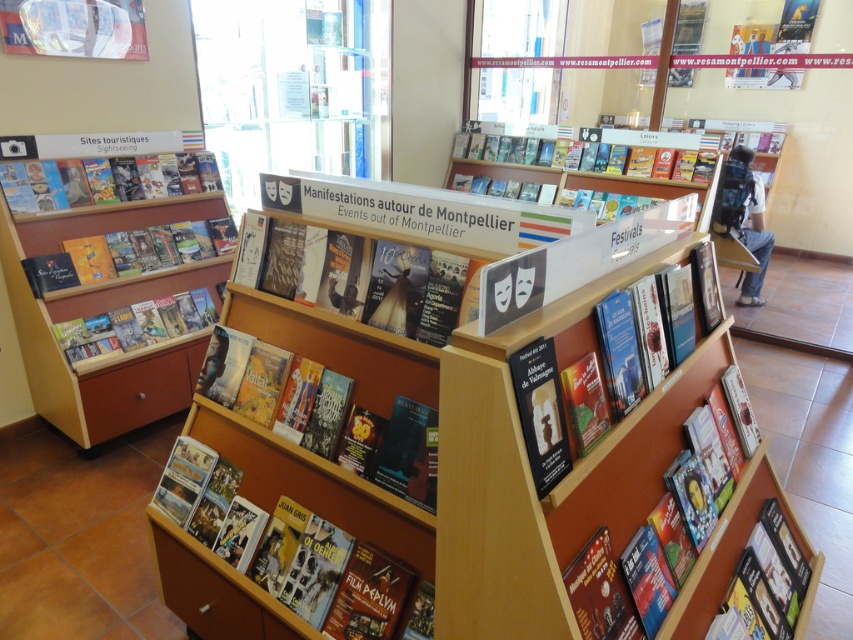
Does wooden bookshelf at left appear under matte black mask at center?

Actually, wooden bookshelf at left is above matte black mask at center.

Which of these two, wooden bookshelf at left or matte black mask at center, stands shorter?

With less height is matte black mask at center.

Does point (148, 164) come behind point (566, 465)?

Yes, it is behind point (566, 465).

Identify the location of wooden bookshelf at left. This screenshot has height=640, width=853. (119, 298).

Measure the distance between point (x=686, y=392) and camera.

Point (x=686, y=392) is 1.55 meters away from camera.

Find the location of a particular element. wooden bookshelf at right is located at coordinates (531, 474).

Is point (430, 563) positioned after point (202, 241)?

No, (430, 563) is closer to viewer.

Between matte paper brochure at lower center and matte black book at left, which one appears on the left side from the viewer's perspective?

matte black book at left is more to the left.

Find the location of `matte paper brochure at lower center`. matte paper brochure at lower center is located at coordinates [218, 589].